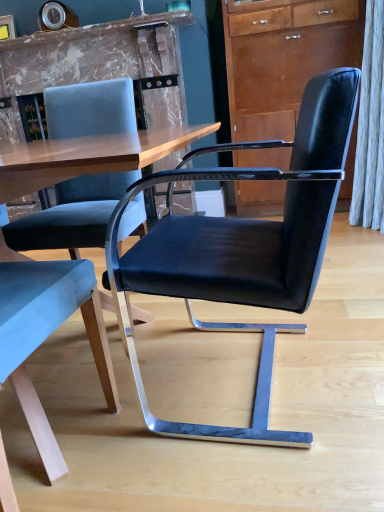
Question: In terms of height, does matte brown cabinet at upper right look taller or shorter compared to black leather chair at center, placed as the second chair when sorted from left to right?

Choices:
 (A) tall
 (B) short

Answer: (A)

Question: From the image's perspective, relative to black leather chair at center, placed as the second chair when sorted from left to right, is matte brown cabinet at upper right above or below?

Choices:
 (A) below
 (B) above

Answer: (B)

Question: Which object is positioned closest to the matte brown cabinet at upper right?

Choices:
 (A) black leather chair at center, placed as the second chair when sorted from left to right
 (B) velvet blue chair at left, which appears as the 2th chair when viewed from the right

Answer: (A)

Question: Which of these objects is positioned closest to the matte brown cabinet at upper right?

Choices:
 (A) black leather chair at center, placed as the second chair when sorted from left to right
 (B) velvet blue chair at left, which appears as the 2th chair when viewed from the right

Answer: (A)